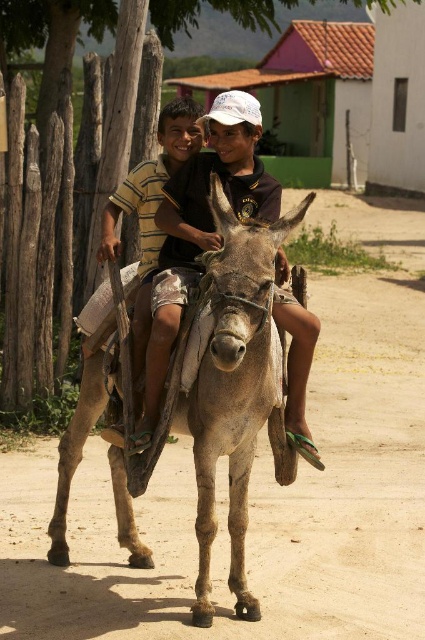
You are a photographer trying to capture a photo of the matte brown donkey at center and the striped cotton shirt at center. From the perspective of someone standing behind the donkey, which object would appear closer to you?

The matte brown donkey at center is in front of the striped cotton shirt at center, so from the perspective of someone standing behind the donkey, the matte brown donkey at center would appear closer.

You are a photographer trying to capture a closeup of the matte brown donkey at center and the striped cotton shirt at center. Given that your camera can only focus on objects within a 10 inch range, will both subjects be in focus?

The matte brown donkey at center is 12.57 inches from striped cotton shirt at center, which exceeds the camera focus range of 10 inches. Therefore, both subjects cannot be in focus simultaneously.

You are standing at the origin point of the image coordinate system. The gray rough mule at center is located at point (235, 388). If you want to walk towards the gray rough mule at center, in which direction should you move relative to the image coordinate system?

Since the gray rough mule at center is located at point (235, 388), you should move towards the right and slightly downward in the image coordinate system to reach it.